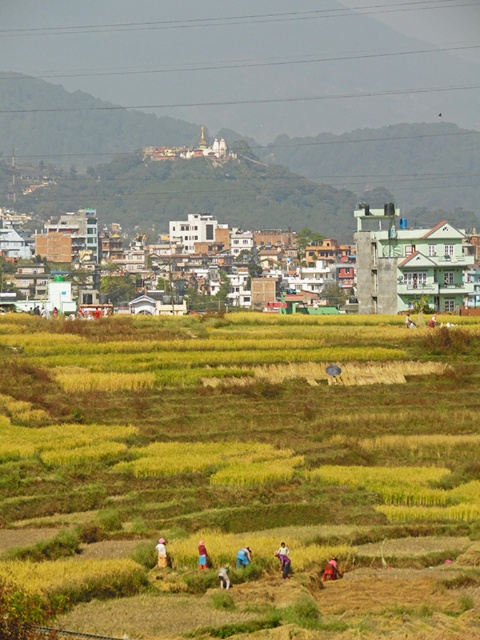
You are standing at the center of the image and want to find the blue jeans at lower center. In which direction should you look?

You should look downward because the blue jeans at lower center is located at point [283,557], which is in the lower part of the image.